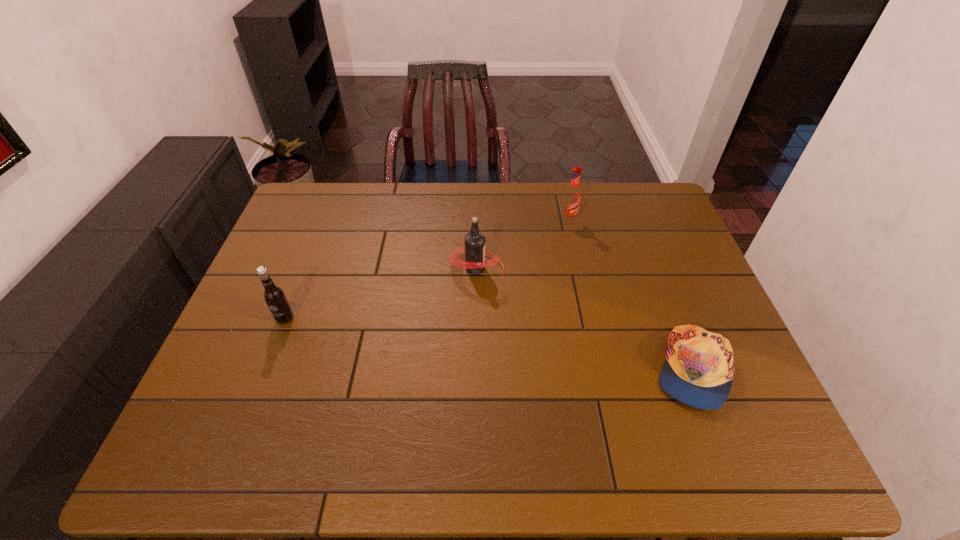
Identify the location of blank region between the farthest root beer and the leftmost object. (426, 270).

The width and height of the screenshot is (960, 540). Find the location of `object that ranks as the third closest to the shortest object`. object that ranks as the third closest to the shortest object is located at coordinates pyautogui.click(x=274, y=296).

Where is `the second closest object relative to the rightmost object`? Image resolution: width=960 pixels, height=540 pixels. the second closest object relative to the rightmost object is located at coordinates (571, 200).

At what (x,y) coordinates should I click in order to perform the action: click on root beer that stands as the second closest to the rightmost object. Please return your answer as a coordinate pair (x, y). The width and height of the screenshot is (960, 540). Looking at the image, I should click on (571, 200).

Identify which root beer is the second closest to the third object from left to right. Please provide its 2D coordinates. Your answer should be formatted as a tuple, i.e. [(x, y)], where the tuple contains the x and y coordinates of a point satisfying the conditions above.

[(274, 296)]

Locate an element on the screen. Image resolution: width=960 pixels, height=540 pixels. vacant area that satisfies the following two spatial constraints: 1. on the front side of the farthest root beer; 2. on the label of the second farthest object is located at coordinates (579, 268).

Where is `vacant space that satisfies the following two spatial constraints: 1. on the label of the second nearest root beer; 2. on the label of the leftmost object`? vacant space that satisfies the following two spatial constraints: 1. on the label of the second nearest root beer; 2. on the label of the leftmost object is located at coordinates (475, 319).

You are a GUI agent. You are given a task and a screenshot of the screen. Output one action in this format:
    pyautogui.click(x=<x>, y=<y>)
    Task: Click on the free space in the image that satisfies the following two spatial constraints: 1. on the label of the second nearest root beer; 2. on the label of the leftmost object
    
    Given the screenshot: What is the action you would take?
    pyautogui.click(x=475, y=319)